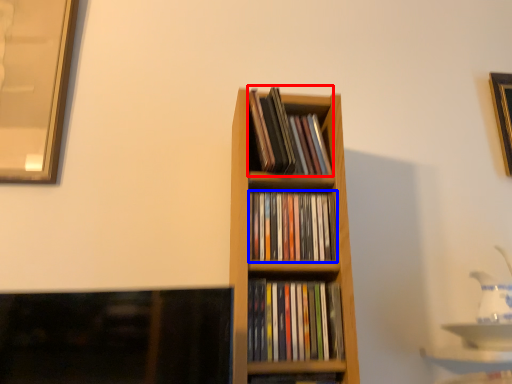
Question: Which object appears farthest to the camera in this image, book (highlighted by a red box) or book (highlighted by a blue box)?

Choices:
 (A) book
 (B) book

Answer: (A)